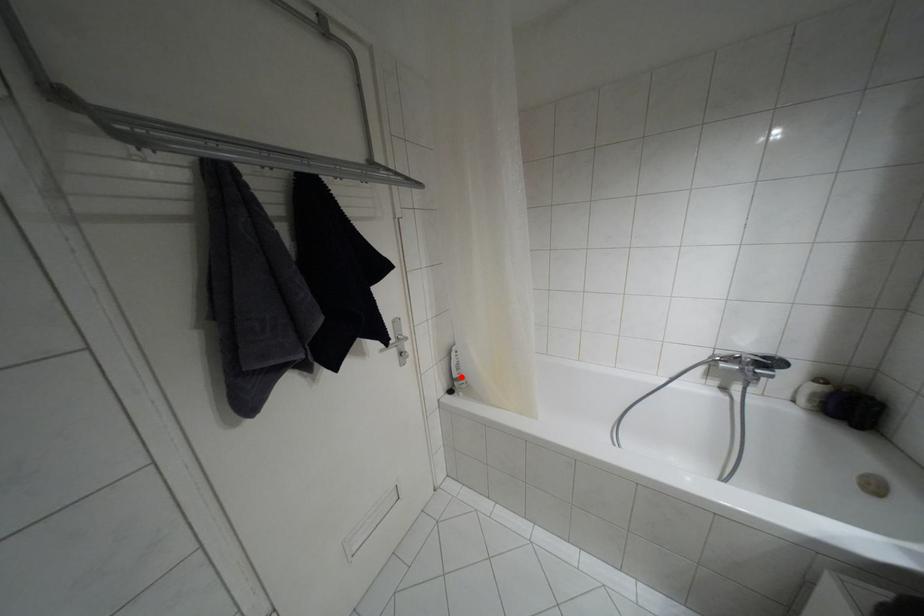
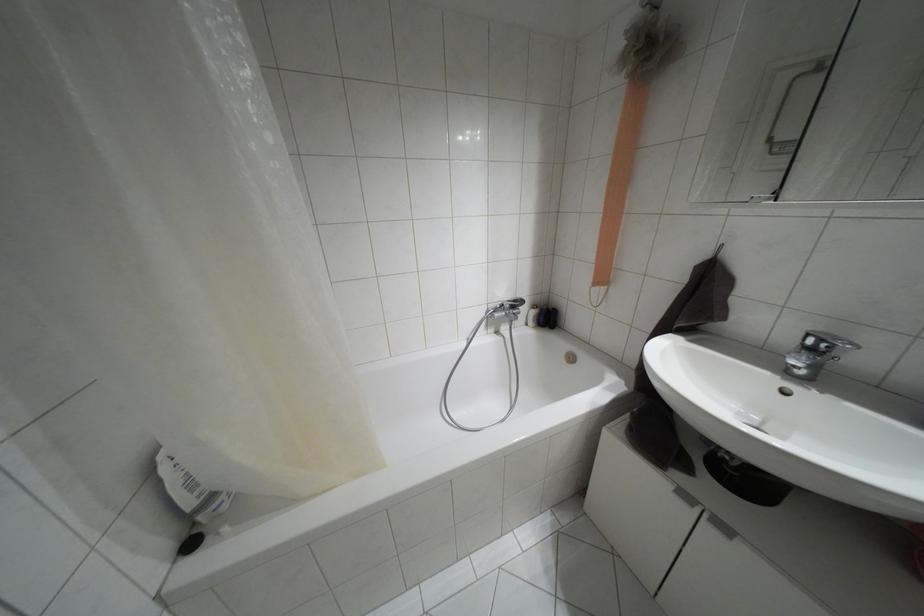
Where in the second image is the point corresponding to the highlighted location from the first image?

(212, 496)